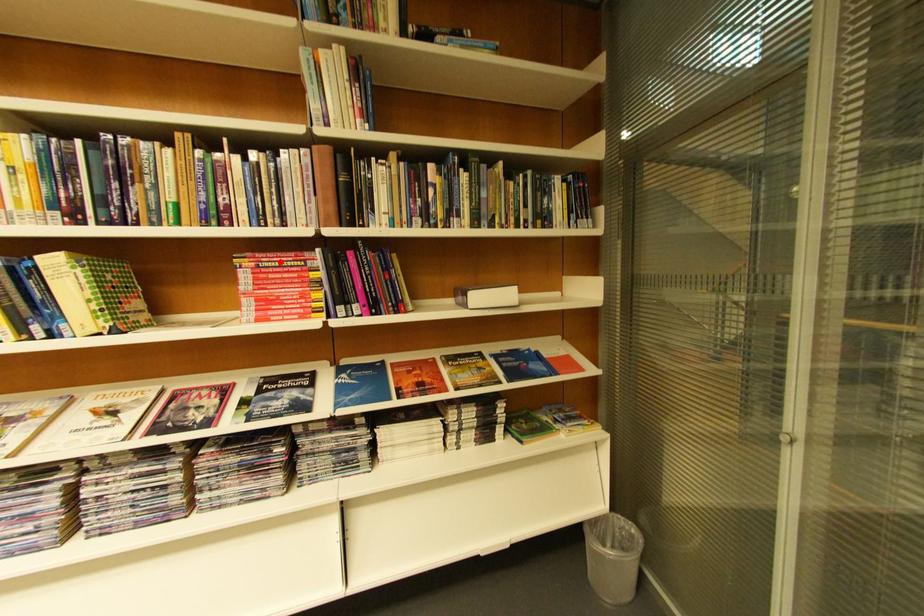
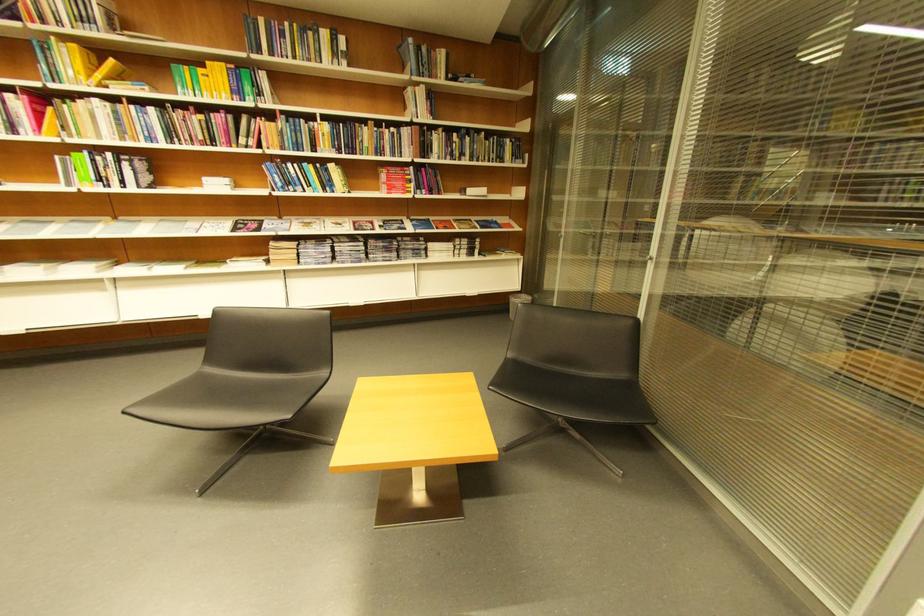
Find the pixel in the second image that matches the highlighted location in the first image.

(403, 172)